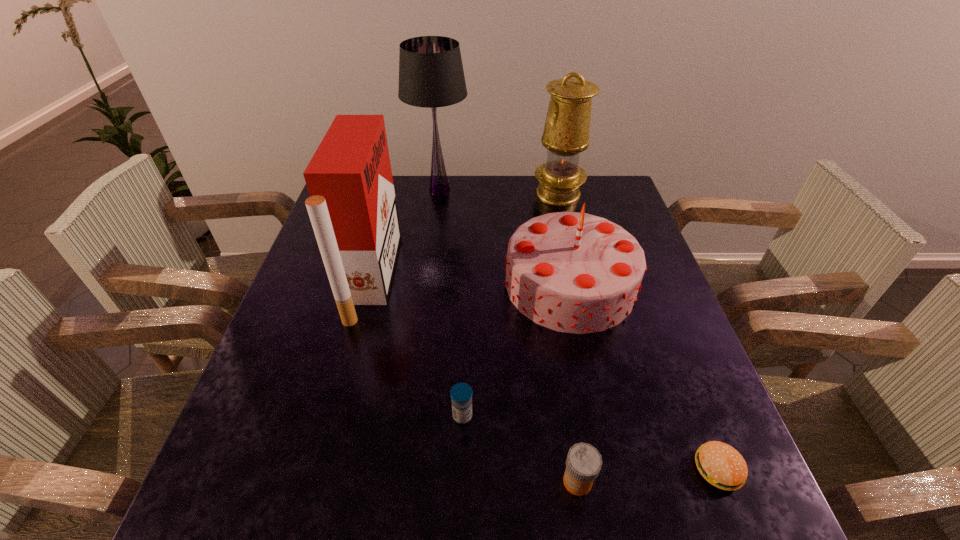
At what (x,y) coordinates should I click in order to perform the action: click on patty located in the near edge section of the desktop. Please return your answer as a coordinate pair (x, y). This screenshot has width=960, height=540. Looking at the image, I should click on (721, 465).

The image size is (960, 540). Identify the location of object that is at the left edge. (352, 206).

Where is `oil lamp situated at the right edge`? The height and width of the screenshot is (540, 960). oil lamp situated at the right edge is located at coordinates (566, 133).

Where is `birthday cake present at the right edge`? This screenshot has height=540, width=960. birthday cake present at the right edge is located at coordinates (572, 272).

You are a GUI agent. You are given a task and a screenshot of the screen. Output one action in this format:
    pyautogui.click(x=<x>, y=<y>)
    Task: Click on the patty located in the right edge section of the desktop
    The image size is (960, 540).
    Given the screenshot: What is the action you would take?
    pyautogui.click(x=721, y=465)

The width and height of the screenshot is (960, 540). What are the coordinates of `object that is positioned at the far right corner` in the screenshot? It's located at (566, 133).

The height and width of the screenshot is (540, 960). What are the coordinates of `object present at the near right corner` in the screenshot? It's located at (721, 465).

At what (x,y) coordinates should I click in order to perform the action: click on vacant space at the far edge of the desktop. Please return your answer as a coordinate pair (x, y). Looking at the image, I should click on pyautogui.click(x=460, y=205).

This screenshot has height=540, width=960. Find the location of `vacant space at the near edge of the desktop`. vacant space at the near edge of the desktop is located at coordinates (383, 492).

Locate an element on the screen. free region at the left edge of the desktop is located at coordinates (308, 359).